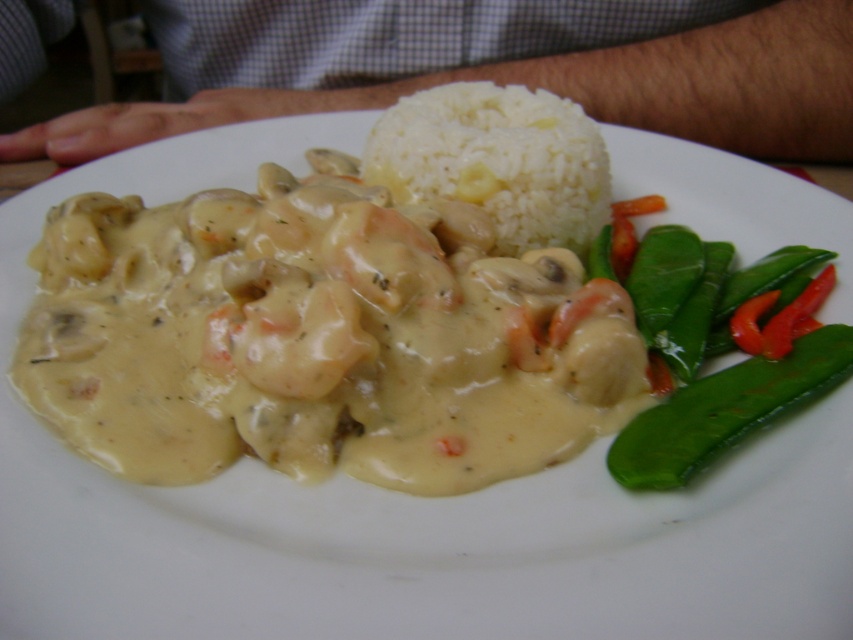
You are a food photographer standing 5 feet away from the plate. You want to capture a closeup of the white matte rice at center without moving the camera. Can you adjust the zoom to focus on it effectively?

The white matte rice at center is 3.39 feet away from the camera. Since you are standing 5 feet away, adjusting the zoom can allow you to focus on the white matte rice at center effectively without moving closer.

You are a food critic evaluating portion sizes. The white matte rice at center and the green smooth bean at lower right are part of the meal. Which of these two items has a larger portion size?

The white matte rice at center has a larger portion size than the green smooth bean at lower right.